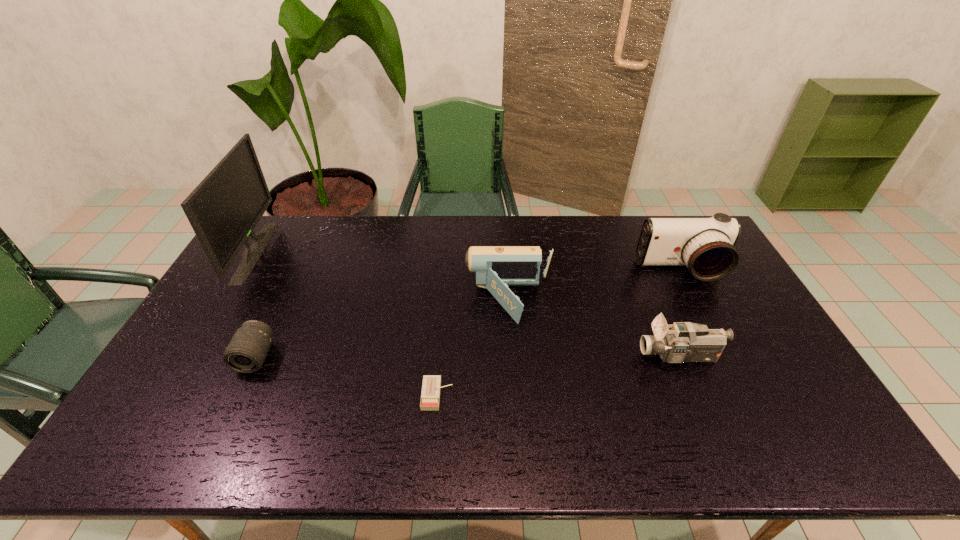
Identify the location of vacant space in between the tallest camcorder and the leftmost camcorder. (595, 286).

You are a GUI agent. You are given a task and a screenshot of the screen. Output one action in this format:
    pyautogui.click(x=<x>, y=<y>)
    Task: Click on the free area in between the third object from left to right and the fifth shortest object
    The width and height of the screenshot is (960, 540).
    Given the screenshot: What is the action you would take?
    pyautogui.click(x=559, y=333)

This screenshot has width=960, height=540. Identify the location of vacant space that is in between the monitor and the nearest camcorder. (468, 304).

Identify the location of vacant region between the tallest camcorder and the leftmost camcorder. The image size is (960, 540). (595, 286).

Locate an element on the screen. The height and width of the screenshot is (540, 960). free area in between the nearest camcorder and the telephoto lens is located at coordinates (468, 356).

Locate an element on the screen. empty space between the nearest camcorder and the matchbox is located at coordinates (559, 375).

You are a GUI agent. You are given a task and a screenshot of the screen. Output one action in this format:
    pyautogui.click(x=<x>, y=<y>)
    Task: Click on the free point between the tallest camcorder and the shortest object
    The image size is (960, 540).
    Given the screenshot: What is the action you would take?
    pyautogui.click(x=559, y=333)

Identify which object is the second closest to the leftmost camcorder. Please provide its 2D coordinates. Your answer should be formatted as a tuple, i.e. [(x, y)], where the tuple contains the x and y coordinates of a point satisfying the conditions above.

[(686, 342)]

You are a GUI agent. You are given a task and a screenshot of the screen. Output one action in this format:
    pyautogui.click(x=<x>, y=<y>)
    Task: Click on the object identified as the second closest to the telephoto lens
    Image resolution: width=960 pixels, height=540 pixels.
    Given the screenshot: What is the action you would take?
    pyautogui.click(x=430, y=397)

Point out which camcorder is positioned as the nearest to the fifth object from right to left. Please provide its 2D coordinates. Your answer should be formatted as a tuple, i.e. [(x, y)], where the tuple contains the x and y coordinates of a point satisfying the conditions above.

[(496, 267)]